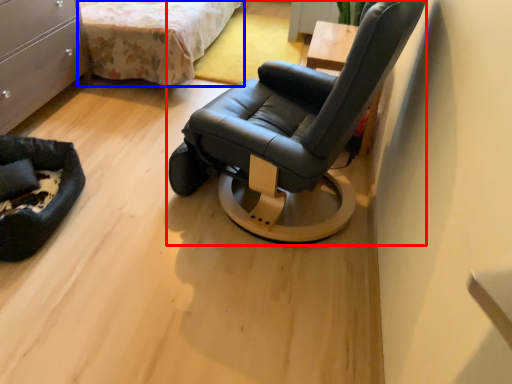
Question: Which object appears farthest to the camera in this image, chair (highlighted by a red box) or bed (highlighted by a blue box)?

Choices:
 (A) chair
 (B) bed

Answer: (B)